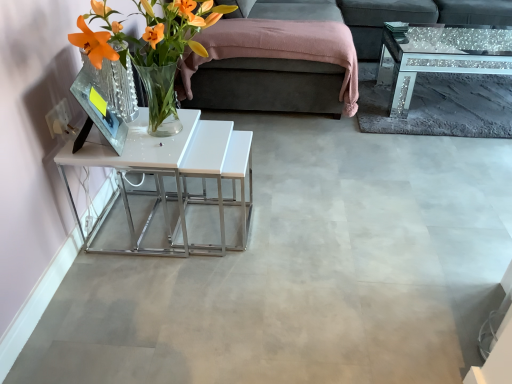
Question: Does white glossy table at left come behind translucent glass vase at left?

Choices:
 (A) no
 (B) yes

Answer: (B)

Question: Is translucent glass vase at left a part of white glossy table at left?

Choices:
 (A) no
 (B) yes

Answer: (A)

Question: Is white glossy table at left turned away from translucent glass vase at left?

Choices:
 (A) yes
 (B) no

Answer: (B)

Question: Is the position of white glossy table at left less distant than that of translucent glass vase at left?

Choices:
 (A) no
 (B) yes

Answer: (A)

Question: From the image's perspective, is white glossy table at left above translucent glass vase at left?

Choices:
 (A) no
 (B) yes

Answer: (A)

Question: Visually, is dark gray fabric couch at upper right positioned to the left or to the right of sparkly glass coffee table at upper right?

Choices:
 (A) right
 (B) left

Answer: (A)

Question: Do you think dark gray fabric couch at upper right is within sparkly glass coffee table at upper right, or outside of it?

Choices:
 (A) inside
 (B) outside

Answer: (B)

Question: Relative to sparkly glass coffee table at upper right, is dark gray fabric couch at upper right in front or behind?

Choices:
 (A) front
 (B) behind

Answer: (B)

Question: Is dark gray fabric couch at upper right wider or thinner than sparkly glass coffee table at upper right?

Choices:
 (A) thin
 (B) wide

Answer: (B)

Question: Is point (456, 6) closer or farther from the camera than point (167, 162)?

Choices:
 (A) closer
 (B) farther

Answer: (B)

Question: Is dark gray fabric couch at upper right inside the boundaries of white glossy table at left, or outside?

Choices:
 (A) inside
 (B) outside

Answer: (B)

Question: Is dark gray fabric couch at upper right in front of or behind white glossy table at left in the image?

Choices:
 (A) behind
 (B) front

Answer: (A)

Question: In the image, is dark gray fabric couch at upper right on the left side or the right side of white glossy table at left?

Choices:
 (A) right
 (B) left

Answer: (A)

Question: Based on their sizes in the image, would you say sparkly glass coffee table at upper right is bigger or smaller than translucent glass vase at left?

Choices:
 (A) big
 (B) small

Answer: (A)

Question: From their relative heights in the image, would you say sparkly glass coffee table at upper right is taller or shorter than translucent glass vase at left?

Choices:
 (A) short
 (B) tall

Answer: (A)